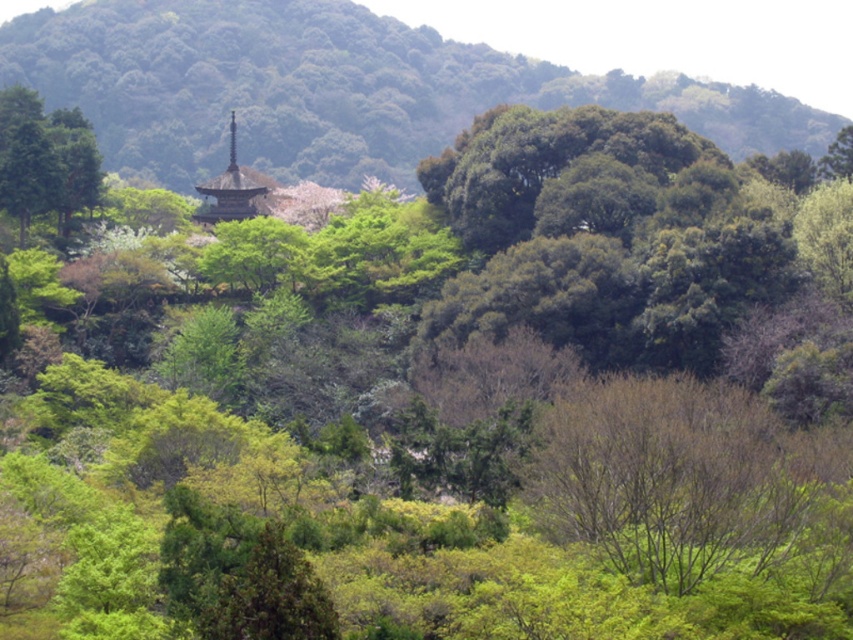
Question: Which of the following is the closest to the observer?

Choices:
 (A) (358, 67)
 (B) (610, 385)
 (C) (199, 186)

Answer: (B)

Question: Does green leafy hillside at upper center lie behind dark brown wooden spire at center?

Choices:
 (A) no
 (B) yes

Answer: (B)

Question: Which of these objects is positioned closest to the bare branches at center?

Choices:
 (A) green leafy hillside at upper center
 (B) dark brown wooden spire at center

Answer: (B)

Question: Can you confirm if green leafy hillside at upper center is positioned below dark brown wooden spire at center?

Choices:
 (A) no
 (B) yes

Answer: (A)

Question: Can you confirm if green leafy hillside at upper center is smaller than bare branches at center?

Choices:
 (A) yes
 (B) no

Answer: (B)

Question: Which of the following is the farthest from the observer?

Choices:
 (A) (213, 216)
 (B) (207, 28)

Answer: (B)